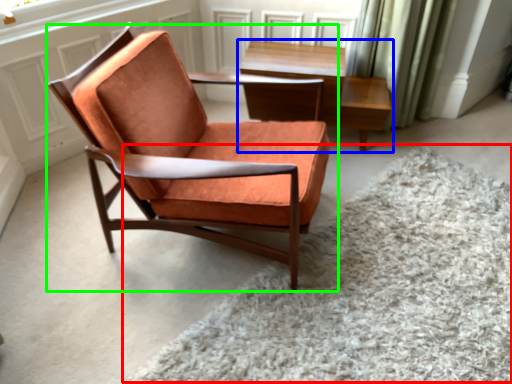
Question: Based on their relative distances, which object is nearer to plain (highlighted by a red box)? Choose from table (highlighted by a blue box) and chair (highlighted by a green box).

Choices:
 (A) table
 (B) chair

Answer: (B)